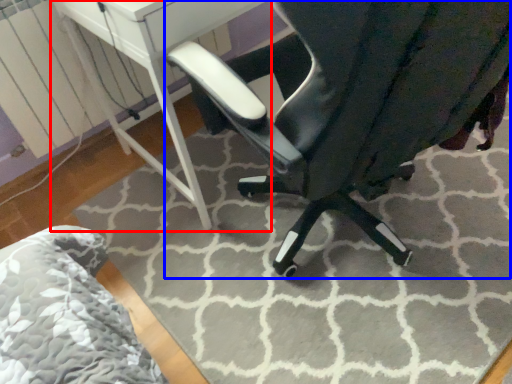
Question: Among these objects, which one is nearest to the camera, table (highlighted by a red box) or chair (highlighted by a blue box)?

Choices:
 (A) table
 (B) chair

Answer: (B)